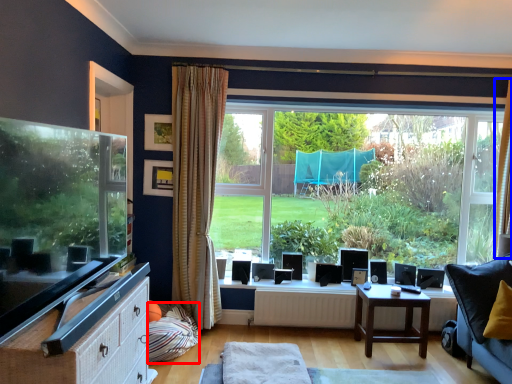
Question: Which point is closer to the camera, pillow (highlighted by a red box) or curtain (highlighted by a blue box)?

Choices:
 (A) pillow
 (B) curtain

Answer: (A)